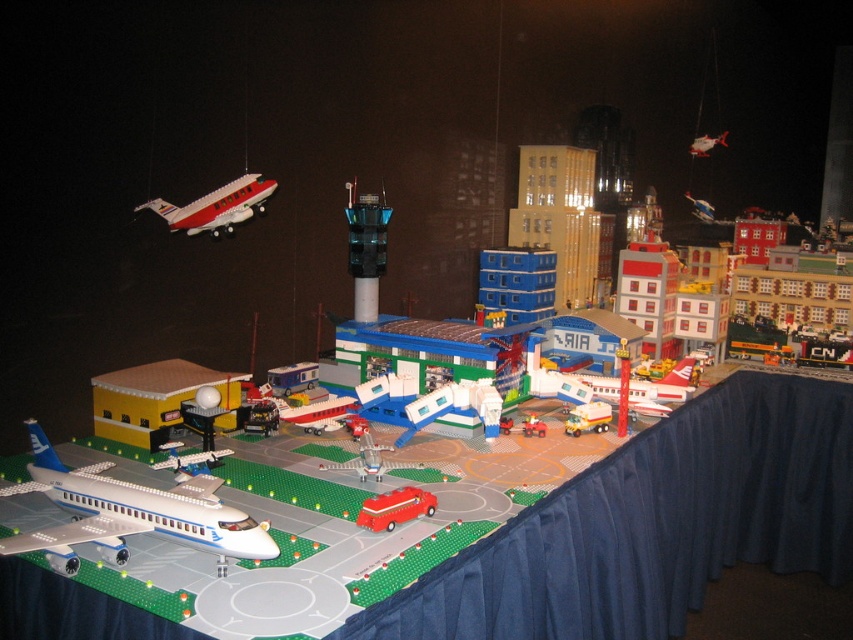
In the scene shown: You are a Lego model designer who wants to add a new structure to the airport scene. You have a small Lego tower that is 10 cm tall. The blue fabric tablecloth at lower right is much taller than the shiny silver airplane at upper right. Can you place the tower between them without it being hidden?

The blue fabric tablecloth at lower right is much taller than the shiny silver airplane at upper right. Since the tower is only 10 cm tall, it might still be visible if placed near the airplane, but it could be hidden if placed closer to the taller tablecloth.

You are a Lego model inspector checking the airport layout. You notice the rubber fire truck at center and the red plastic car at center. According to the airport safety guidelines, the fire truck must be positioned behind the service car for quick access. Is the current arrangement compliant with the guidelines?

The rubber fire truck at center is in front of the red plastic car at center, which means it is not positioned behind the service car as required by the guidelines. The arrangement is not compliant.

You are a Lego model designer who needs to place a new Lego structure between the blue fabric tablecloth at lower right and the shiny silver airplane at upper right. The structure must be exactly 3.21 feet wide. Is there enough space for it?

The distance between the blue fabric tablecloth at lower right and the shiny silver airplane at upper right is 6.42 feet. Since the structure needs to be 3.21 feet wide, which is exactly half of the available space, there is enough room to place it between them.